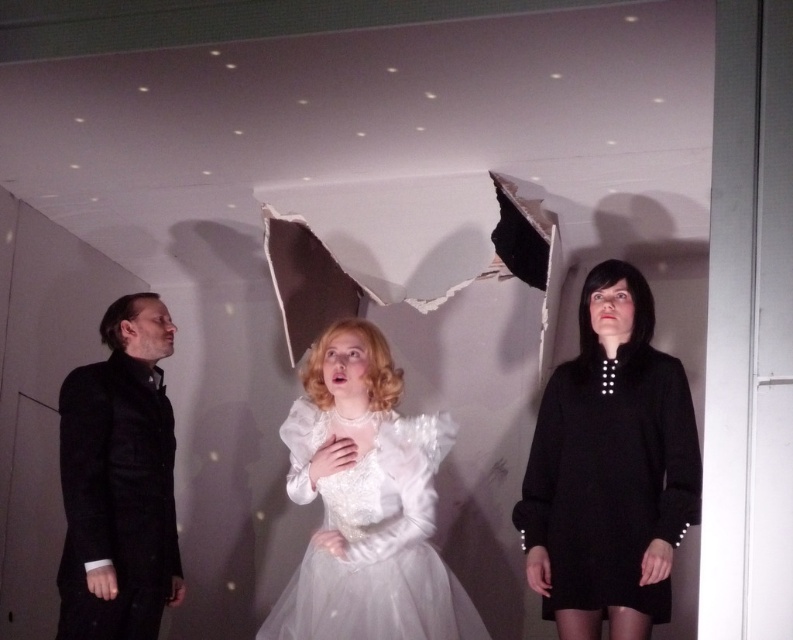
You are an observer in the scene. You see the black matte dress at right and the black matte suit at left. Which one is positioned higher in the frame?

The black matte dress at right is located above the black matte suit at left, so it is positioned higher in the frame.

You are an actor positioned behind the black matte suit at left and the white tulle dress at center. Which actor should you move first to exit the stage through the door behind them?

You should move the white tulle dress at center first because the black matte suit at left is closer to you, making the white tulle dress at center farther back and thus needing to exit first to avoid blocking.

You are an actor positioned at point A, which is at coordinates point (673, 499). You need to move to point B, located at point (71, 634). However, there is a large hole in the wall behind the stage. Will your path from point A to point B be blocked by the hole?

Point (673, 499) is in front of point (71, 634), so moving from point A to point B would not be blocked by the hole in the wall since point A is closer to the viewer than point B.